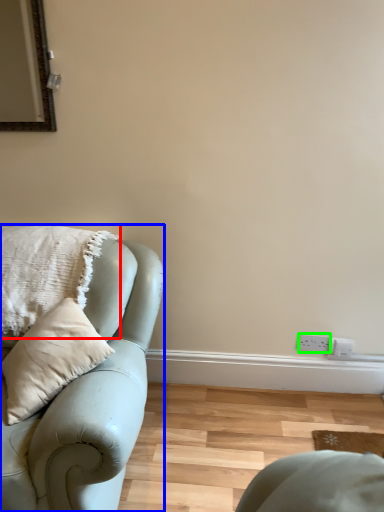
Question: Which is nearer to the pillow (highlighted by a red box)? studio couch (highlighted by a blue box) or electric outlet (highlighted by a green box).

Choices:
 (A) studio couch
 (B) electric outlet

Answer: (A)